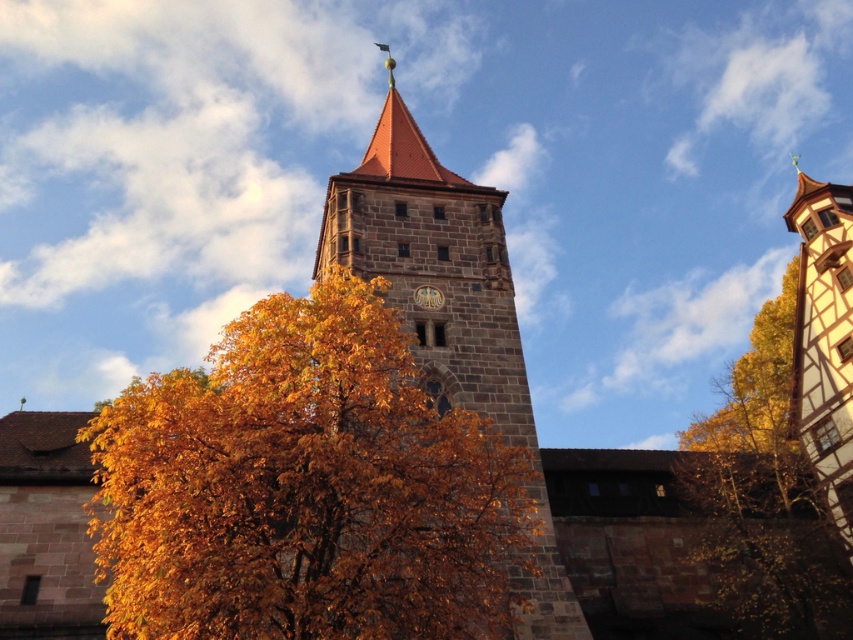
Does yellow leaves at upper right have a smaller size compared to wooden half-timbered house at right?

Yes.

Which of these two, yellow leaves at upper right or wooden half-timbered house at right, stands taller?

wooden half-timbered house at right

Is point (727, 432) closer to viewer compared to point (807, 317)?

No, it is behind (807, 317).

I want to click on yellow leaves at upper right, so click(764, 496).

Is wooden half-timbered house at right wider than dark brown stone clock at center?

Yes.

Can you confirm if wooden half-timbered house at right is positioned to the left of dark brown stone clock at center?

No, wooden half-timbered house at right is not to the left of dark brown stone clock at center.

Where is `wooden half-timbered house at right`? This screenshot has width=853, height=640. wooden half-timbered house at right is located at coordinates (824, 340).

At what (x,y) coordinates should I click in order to perform the action: click on wooden half-timbered house at right. Please return your answer as a coordinate pair (x, y). The height and width of the screenshot is (640, 853). Looking at the image, I should click on (824, 340).

Does dark brown stone tower at center appear over yellow leaves at upper right?

Yes, dark brown stone tower at center is above yellow leaves at upper right.

Which is more to the right, dark brown stone tower at center or yellow leaves at upper right?

From the viewer's perspective, yellow leaves at upper right appears more on the right side.

Locate an element on the screen. This screenshot has height=640, width=853. dark brown stone tower at center is located at coordinates (448, 307).

Locate an element on the screen. The height and width of the screenshot is (640, 853). dark brown stone tower at center is located at coordinates (448, 307).